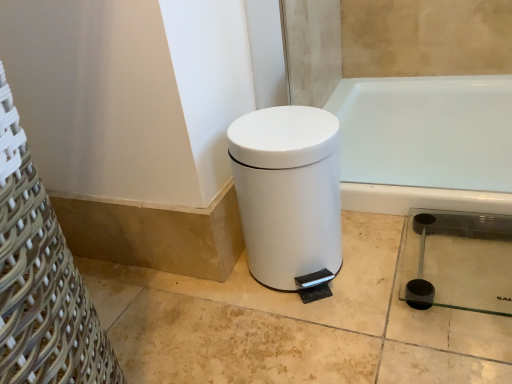
The width and height of the screenshot is (512, 384). Identify the location of vacant space to the left of white matte waste container at lower center. (195, 313).